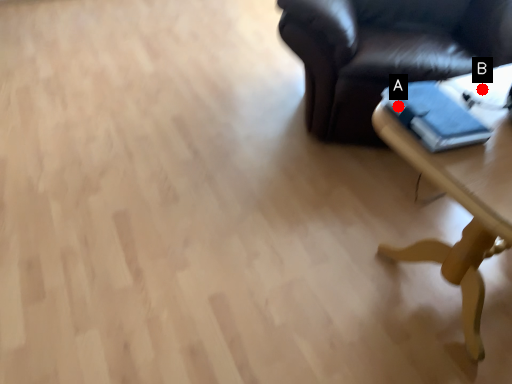
Question: Two points are circled on the image, labeled by A and B beside each circle. Among these points, which one is farthest from the camera?

Choices:
 (A) A is further
 (B) B is further

Answer: (B)